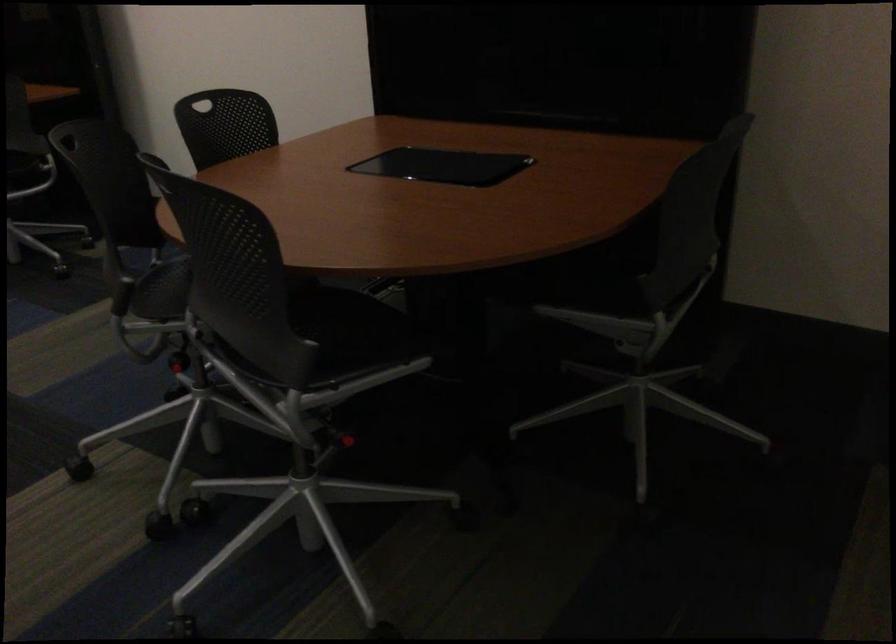
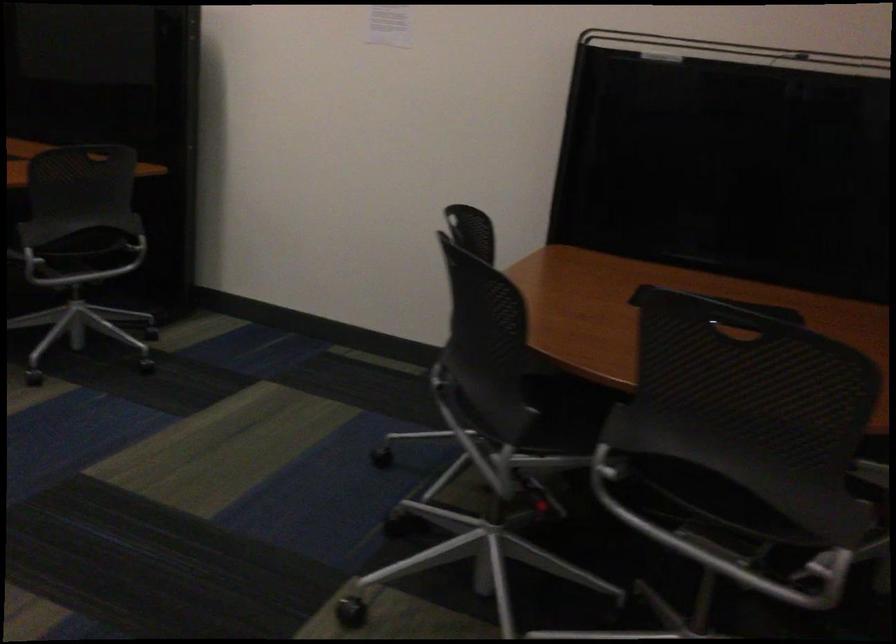
Question: What movement of the cameraman would produce the second image?

Choices:
 (A) Left
 (B) Right
 (C) Forward
 (D) Backward

Answer: (A)